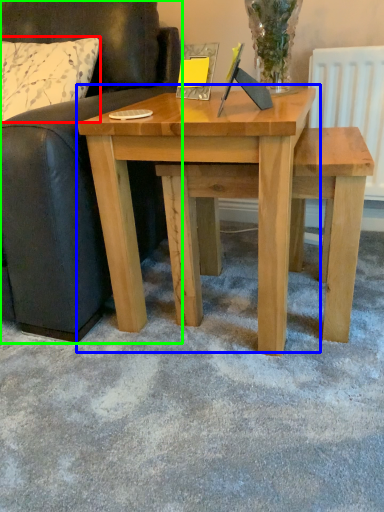
Question: Which object is positioned closest to pillow (highlighted by a red box)? Select from table (highlighted by a blue box) and studio couch (highlighted by a green box).

Choices:
 (A) table
 (B) studio couch

Answer: (B)